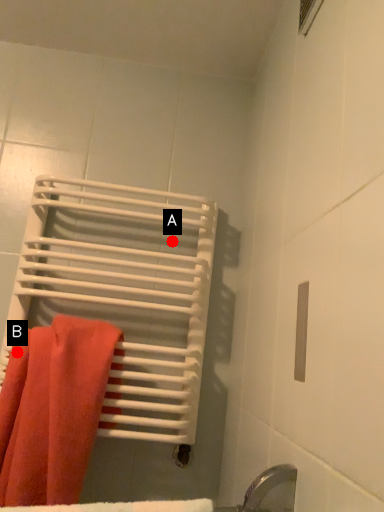
Question: Two points are circled on the image, labeled by A and B beside each circle. Which point is farther from the camera taking this photo?

Choices:
 (A) A is further
 (B) B is further

Answer: (A)